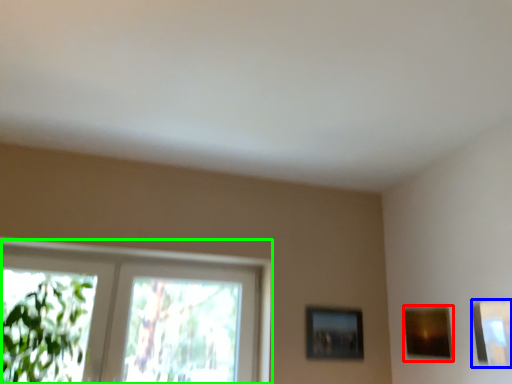
Question: Which is nearer to the picture frame (highlighted by a red box)? picture frame (highlighted by a blue box) or window (highlighted by a green box).

Choices:
 (A) picture frame
 (B) window

Answer: (A)